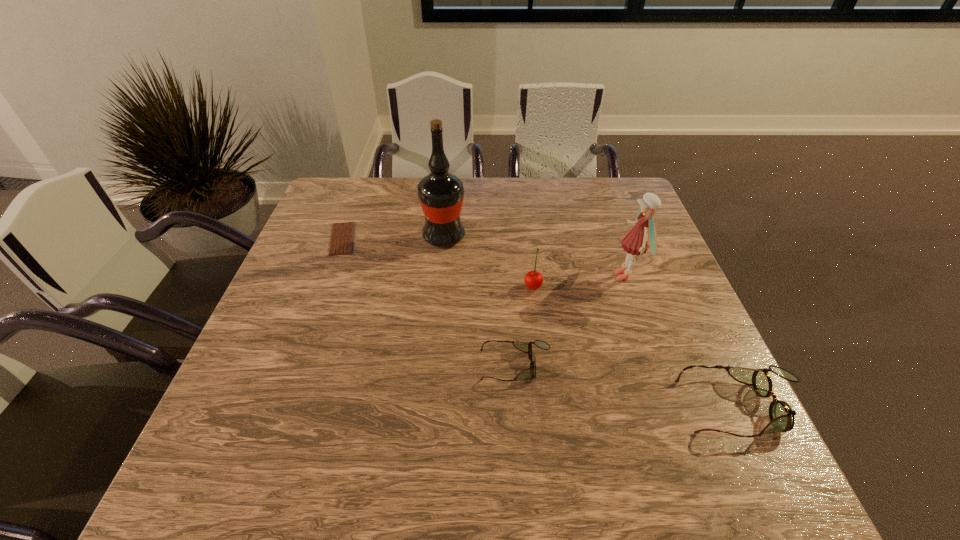
Find the location of a particular element. Image resolution: width=960 pixels, height=540 pixels. vacant place for an extra spectacles on the left is located at coordinates (323, 330).